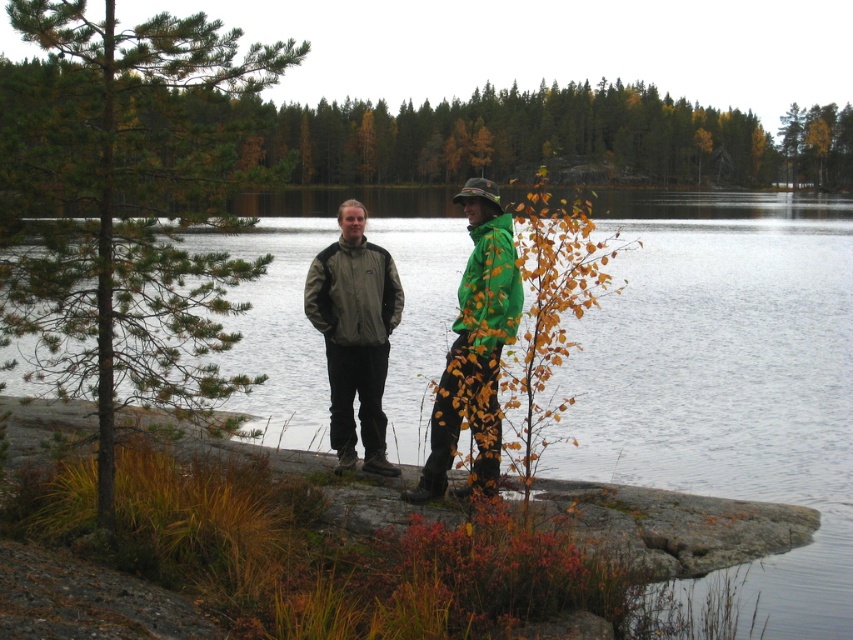
You are a photographer positioned behind both individuals in the scene. You want to take a photo that clearly shows both the green matte jacket at center and the matte gray jacket at center. Which jacket will appear larger in the photo?

The green matte jacket at center will appear larger in the photo because it is closer to the viewer than the matte gray jacket at center.

You are planning to take a photo of the green pine tree at left and the matte gray jacket at center. Which object is taller in the scene?

The green pine tree at left is taller than the matte gray jacket at center.